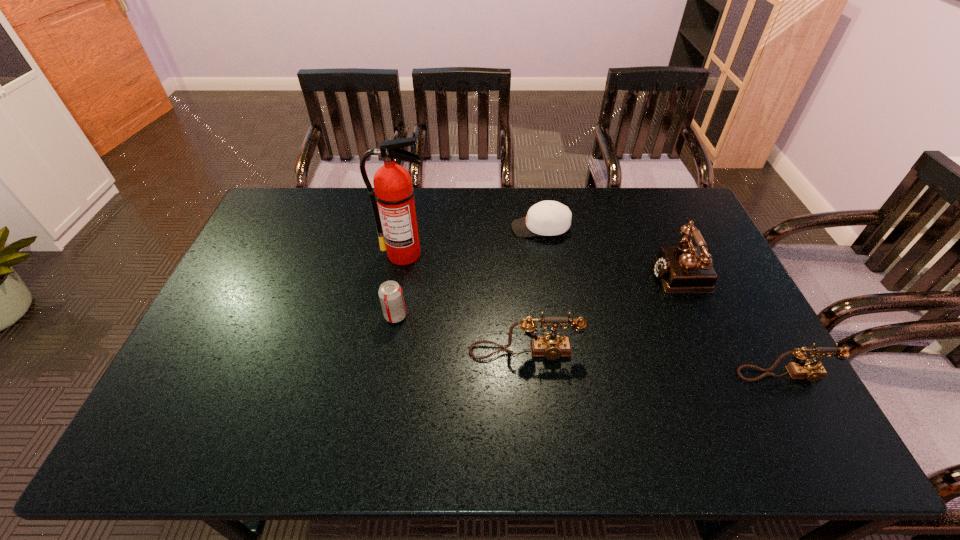
You are a GUI agent. You are given a task and a screenshot of the screen. Output one action in this format:
    pyautogui.click(x=<x>, y=<y>)
    Task: Click on the vacant space that is in between the shortest telephone and the farthest telephone
    
    Given the screenshot: What is the action you would take?
    pyautogui.click(x=733, y=323)

The width and height of the screenshot is (960, 540). In order to click on free space that is in between the farthest telephone and the farthest object in this screenshot , I will do `click(612, 251)`.

Find the location of a particular element. unoccupied position between the farthest telephone and the fire extinguisher is located at coordinates (543, 264).

Where is `free space that is in between the third nearest object and the tallest object`? Image resolution: width=960 pixels, height=540 pixels. free space that is in between the third nearest object and the tallest object is located at coordinates (400, 285).

Locate an element on the screen. free space between the leftmost telephone and the soda can is located at coordinates (460, 334).

Where is `free space that is in between the second shortest telephone and the farthest object`? This screenshot has width=960, height=540. free space that is in between the second shortest telephone and the farthest object is located at coordinates (533, 290).

Image resolution: width=960 pixels, height=540 pixels. I want to click on blank region between the tallest object and the shortest telephone, so click(594, 314).

In order to click on object that is the second closest to the fire extinguisher in this screenshot , I will do `click(548, 218)`.

Find the location of `object that is the fourth closest to the fire extinguisher`. object that is the fourth closest to the fire extinguisher is located at coordinates (685, 269).

Select which telephone is the third closest to the fire extinguisher. Please provide its 2D coordinates. Your answer should be formatted as a tuple, i.e. [(x, y)], where the tuple contains the x and y coordinates of a point satisfying the conditions above.

[(802, 368)]